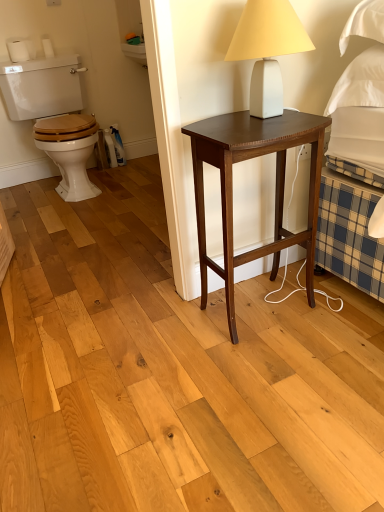
You are a GUI agent. You are given a task and a screenshot of the screen. Output one action in this format:
    pyautogui.click(x=<x>, y=<y>)
    Task: Click on the free space in front of white matte table lamp at upper right
    
    Given the screenshot: What is the action you would take?
    (x=278, y=126)